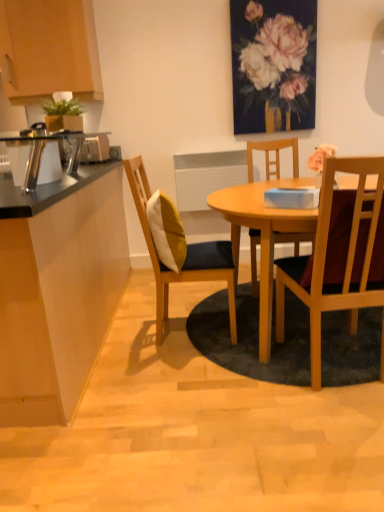
Question: From a real-world perspective, is wooden chair with cushion at center, which is the 1th chair in left-to-right order, on wooden cabinet at upper left?

Choices:
 (A) no
 (B) yes

Answer: (A)

Question: Would you say wooden chair with cushion at center, arranged as the second chair when viewed from the right, contains wooden cabinet at upper left?

Choices:
 (A) no
 (B) yes

Answer: (A)

Question: Can you confirm if wooden chair with cushion at center, arranged as the second chair when viewed from the right, is bigger than wooden cabinet at upper left?

Choices:
 (A) yes
 (B) no

Answer: (A)

Question: Is wooden chair with cushion at center, arranged as the second chair when viewed from the right, placed right next to wooden cabinet at upper left?

Choices:
 (A) no
 (B) yes

Answer: (A)

Question: Considering the relative positions of wooden chair with cushion at center, arranged as the second chair when viewed from the right, and wooden cabinet at upper left in the image provided, is wooden chair with cushion at center, arranged as the second chair when viewed from the right, in front of wooden cabinet at upper left?

Choices:
 (A) yes
 (B) no

Answer: (A)

Question: Which is correct: wooden chair with cushion at center, arranged as the second chair when viewed from the right, is inside wooden cabinet at upper left, or outside of it?

Choices:
 (A) outside
 (B) inside

Answer: (A)

Question: Would you say wooden chair with cushion at center, which is the 1th chair in left-to-right order, is to the left or to the right of wooden cabinet at upper left in the picture?

Choices:
 (A) left
 (B) right

Answer: (B)

Question: From a real-world perspective, is wooden chair with cushion at center, which is the 1th chair in left-to-right order, positioned above or below wooden cabinet at upper left?

Choices:
 (A) above
 (B) below

Answer: (B)

Question: Based on their sizes in the image, would you say wooden chair with cushion at center, arranged as the second chair when viewed from the right, is bigger or smaller than wooden cabinet at upper left?

Choices:
 (A) small
 (B) big

Answer: (B)

Question: Is point (312, 279) closer or farther from the camera than point (39, 128)?

Choices:
 (A) farther
 (B) closer

Answer: (B)

Question: Is wooden chair at right, which is the first chair in right-to-left order, inside the boundaries of metallic silver toaster at left, acting as the 1th appliance starting from the bottom, or outside?

Choices:
 (A) outside
 (B) inside

Answer: (A)

Question: Based on their positions, is wooden chair at right, which is the first chair in right-to-left order, located to the left or right of metallic silver toaster at left, acting as the 2th appliance starting from the top?

Choices:
 (A) right
 (B) left

Answer: (A)

Question: In terms of height, does wooden chair at right, which is the first chair in right-to-left order, look taller or shorter compared to metallic silver toaster at left, arranged as the 2th appliance when viewed from the back?

Choices:
 (A) short
 (B) tall

Answer: (B)

Question: From a real-world perspective, relative to wooden chair at right, which is the first chair in right-to-left order, is wooden chair with cushion at center, arranged as the second chair when viewed from the right, vertically above or below?

Choices:
 (A) below
 (B) above

Answer: (A)

Question: From the image's perspective, is wooden chair with cushion at center, arranged as the second chair when viewed from the right, positioned above or below wooden chair at right, which ranks as the second chair in left-to-right order?

Choices:
 (A) below
 (B) above

Answer: (B)